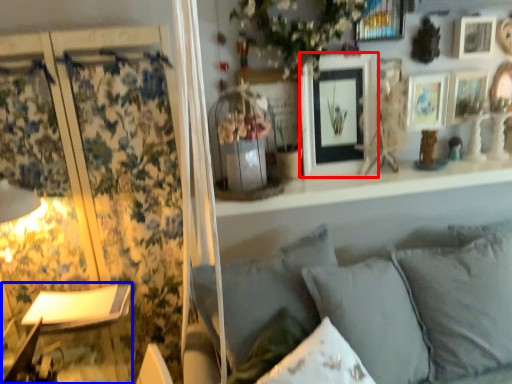
Question: Among these objects, which one is farthest to the camera, picture frame (highlighted by a red box) or table lamp (highlighted by a blue box)?

Choices:
 (A) picture frame
 (B) table lamp

Answer: (A)